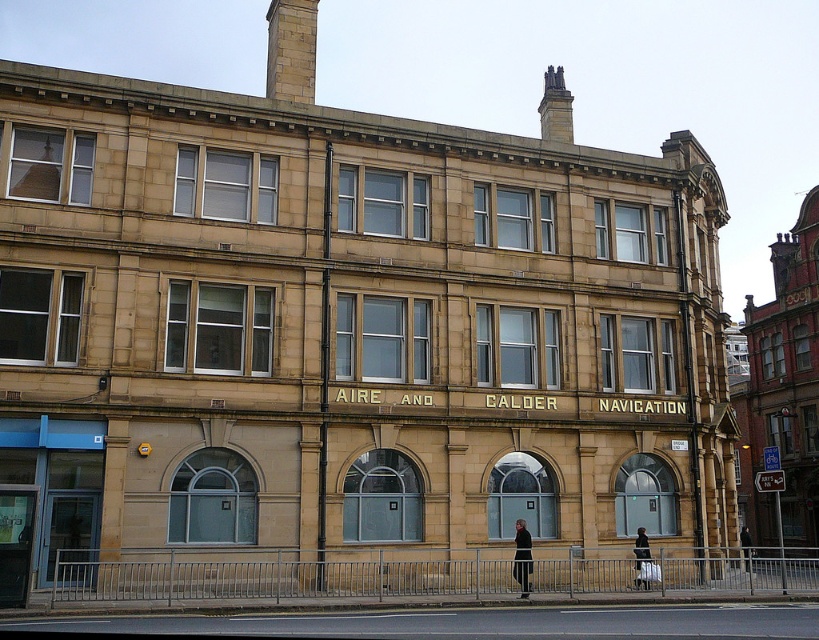
You are standing in front of the historic building and notice two items hanging on a rack at the center. The items are the black fabric at center and the dark gray jacket at center. Which item is located to the left when viewed from the front of the building?

The black fabric at center is positioned on the left side of dark gray jacket at center, so when viewed from the front of the building, the black fabric at center is located to the left of the dark gray jacket at center.

You are standing in front of the historic building and see both the black fabric at center and the dark gray jacket at center. Which object is closer to you?

The black fabric at center is closer to you because it is in front of the dark gray jacket at center.

You are standing in front of the historic building and see a white fabric bag at center and a dark gray jacket at center. Which item is closer to you?

Result: The white fabric bag at center is closer to you than the dark gray jacket at center because it is further to the viewer.